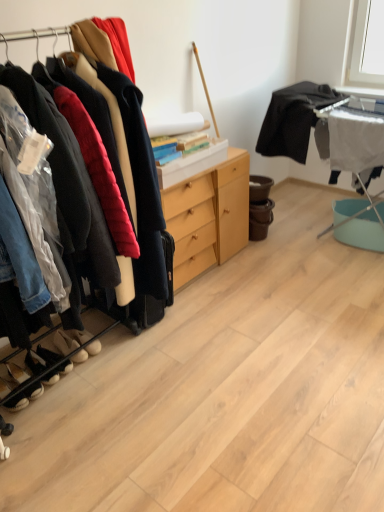
At what (x,y) coordinates should I click in order to perform the action: click on black suede shoes at lower left, acting as the third footwear starting from the front. Please return your answer as a coordinate pair (x, y). The width and height of the screenshot is (384, 512). Looking at the image, I should click on (48, 355).

Measure the distance between black suede shoes at lower left, which appears as the fourth footwear when viewed from the back, and camera.

They are 6.57 feet apart.

The height and width of the screenshot is (512, 384). In order to click on white suede shoes at lower left, which ranks as the 5th footwear in front-to-back order in this screenshot , I will do `click(79, 336)`.

Describe the element at coordinates (65, 342) in the screenshot. Image resolution: width=384 pixels, height=512 pixels. I see `suede beige shoes at lower left, the 2th footwear viewed from the back` at that location.

Find the location of `black suede shoes at lower left, arranged as the third footwear when viewed from the back`. black suede shoes at lower left, arranged as the third footwear when viewed from the back is located at coordinates (48, 355).

In the image, is black suede shoes at lower left, which appears as the second footwear when viewed from the front, positioned in front of or behind white suede shoes at lower left, the fifth footwear in the back-to-front sequence?

black suede shoes at lower left, which appears as the second footwear when viewed from the front, is positioned farther from the viewer than white suede shoes at lower left, the fifth footwear in the back-to-front sequence.

Measure the distance from black suede shoes at lower left, which appears as the fourth footwear when viewed from the back, to white suede shoes at lower left, the fifth footwear in the back-to-front sequence.

black suede shoes at lower left, which appears as the fourth footwear when viewed from the back, and white suede shoes at lower left, the fifth footwear in the back-to-front sequence, are 8.61 centimeters apart from each other.

Can you confirm if black suede shoes at lower left, which appears as the second footwear when viewed from the front, is bigger than white suede shoes at lower left, the fifth footwear in the back-to-front sequence?

No.

Does black suede shoes at lower left, which appears as the second footwear when viewed from the front, appear on the right side of white suede shoes at lower left, the 1th footwear viewed from the front?

Correct, you'll find black suede shoes at lower left, which appears as the second footwear when viewed from the front, to the right of white suede shoes at lower left, the 1th footwear viewed from the front.

Is white suede shoes at lower left, the fifth footwear in the back-to-front sequence, to the right of black suede shoes at lower left, arranged as the third footwear when viewed from the back, from the viewer's perspective?

Incorrect, white suede shoes at lower left, the fifth footwear in the back-to-front sequence, is not on the right side of black suede shoes at lower left, arranged as the third footwear when viewed from the back.

Looking at this image, can you tell me how much white suede shoes at lower left, the 1th footwear viewed from the front, and black suede shoes at lower left, acting as the third footwear starting from the front, differ in facing direction?

0.000767 degrees.

How much distance is there between white suede shoes at lower left, the fifth footwear in the back-to-front sequence, and black suede shoes at lower left, acting as the third footwear starting from the front?

6.27 inches.

In the image, is white suede shoes at lower left, the 1th footwear viewed from the front, positioned in front of or behind black suede shoes at lower left, arranged as the third footwear when viewed from the back?

white suede shoes at lower left, the 1th footwear viewed from the front, is positioned closer to the viewer than black suede shoes at lower left, arranged as the third footwear when viewed from the back.

Could you tell me if light wood/finely finished cabinet at center is turned towards white suede shoes at lower left, the 1th footwear viewed from the front?

No, light wood/finely finished cabinet at center does not turn towards white suede shoes at lower left, the 1th footwear viewed from the front.

Is light wood/finely finished cabinet at center bigger than white suede shoes at lower left, the fifth footwear in the back-to-front sequence?

Yes.

Image resolution: width=384 pixels, height=512 pixels. Identify the location of cabinetry that appears above the white suede shoes at lower left, the 1th footwear viewed from the front (from a real-world perspective). (208, 216).

From the image's perspective, is light wood/finely finished cabinet at center under white suede shoes at lower left, the fifth footwear in the back-to-front sequence?

Incorrect, from the image's perspective, light wood/finely finished cabinet at center is higher than white suede shoes at lower left, the fifth footwear in the back-to-front sequence.

Does white fabric ironing board at right have a larger size compared to suede beige shoes at lower left, placed as the 4th footwear when sorted from front to back?

Yes.

Is suede beige shoes at lower left, placed as the 4th footwear when sorted from front to back, inside white fabric ironing board at right?

Definitely not — suede beige shoes at lower left, placed as the 4th footwear when sorted from front to back, is not inside white fabric ironing board at right.

Between white fabric ironing board at right and suede beige shoes at lower left, placed as the 4th footwear when sorted from front to back, which one has larger width?

Wider between the two is suede beige shoes at lower left, placed as the 4th footwear when sorted from front to back.

Is black suede shoes at lower left, which appears as the second footwear when viewed from the front, facing towards black suede shoes at lower left, acting as the third footwear starting from the front?

No, black suede shoes at lower left, which appears as the second footwear when viewed from the front, is not aimed at black suede shoes at lower left, acting as the third footwear starting from the front.

Locate an element on the screen. footwear that is the 1st object directly below the black suede shoes at lower left, arranged as the third footwear when viewed from the back (from a real-world perspective) is located at coordinates (35, 362).

Between black suede shoes at lower left, which appears as the second footwear when viewed from the front, and black suede shoes at lower left, arranged as the third footwear when viewed from the back, which one has more height?

With more height is black suede shoes at lower left, which appears as the second footwear when viewed from the front.

Is point (78, 346) more distant than point (97, 341)?

No, (78, 346) is in front of (97, 341).

In the scene shown: Is suede beige shoes at lower left, placed as the 4th footwear when sorted from front to back, smaller than white suede shoes at lower left, the 1th footwear viewed from the back?

Yes.

Are suede beige shoes at lower left, placed as the 4th footwear when sorted from front to back, and white suede shoes at lower left, which ranks as the 5th footwear in front-to-back order, making contact?

Absolutely, suede beige shoes at lower left, placed as the 4th footwear when sorted from front to back, is next to and touching white suede shoes at lower left, which ranks as the 5th footwear in front-to-back order.

Is suede beige shoes at lower left, the 2th footwear viewed from the back, not within white suede shoes at lower left, which ranks as the 5th footwear in front-to-back order?

Yes, suede beige shoes at lower left, the 2th footwear viewed from the back, is located beyond the bounds of white suede shoes at lower left, which ranks as the 5th footwear in front-to-back order.

From the picture: From the image's perspective, which one is positioned lower, suede beige shoes at lower left, the 2th footwear viewed from the back, or light wood/finely finished cabinet at center?

suede beige shoes at lower left, the 2th footwear viewed from the back, is shown below in the image.

Does suede beige shoes at lower left, the 2th footwear viewed from the back, have a larger size compared to light wood/finely finished cabinet at center?

Actually, suede beige shoes at lower left, the 2th footwear viewed from the back, might be smaller than light wood/finely finished cabinet at center.

Which of these two, suede beige shoes at lower left, the 2th footwear viewed from the back, or light wood/finely finished cabinet at center, stands taller?

With more height is light wood/finely finished cabinet at center.

Would you say suede beige shoes at lower left, placed as the 4th footwear when sorted from front to back, contains light wood/finely finished cabinet at center?

That's incorrect, light wood/finely finished cabinet at center is not inside suede beige shoes at lower left, placed as the 4th footwear when sorted from front to back.

Where is `the 1st footwear above when counting from the white suede shoes at lower left, the fifth footwear in the back-to-front sequence (from the image's perspective)`? This screenshot has width=384, height=512. the 1st footwear above when counting from the white suede shoes at lower left, the fifth footwear in the back-to-front sequence (from the image's perspective) is located at coordinates (35, 362).

Identify the location of the 2nd footwear counting from the right of the white suede shoes at lower left, the 1th footwear viewed from the front. The image size is (384, 512). tap(48, 355).

Which object lies nearer to the anchor point white suede shoes at lower left, which ranks as the 5th footwear in front-to-back order, black matte shirt at upper right or light wood/finely finished cabinet at center?

light wood/finely finished cabinet at center lies closer to white suede shoes at lower left, which ranks as the 5th footwear in front-to-back order, than the other object.

From the image, which object appears to be nearer to black suede shoes at lower left, which appears as the fourth footwear when viewed from the back, light wood/finely finished cabinet at center or black suede shoes at lower left, acting as the third footwear starting from the front?

Based on the image, black suede shoes at lower left, acting as the third footwear starting from the front, appears to be nearer to black suede shoes at lower left, which appears as the fourth footwear when viewed from the back.

From the image, which object appears to be nearer to suede beige shoes at lower left, placed as the 4th footwear when sorted from front to back, black suede shoes at lower left, arranged as the third footwear when viewed from the back, or light wood/finely finished cabinet at center?

black suede shoes at lower left, arranged as the third footwear when viewed from the back, is positioned closer to the anchor suede beige shoes at lower left, placed as the 4th footwear when sorted from front to back.

When comparing their distances from black suede shoes at lower left, arranged as the third footwear when viewed from the back, does suede beige shoes at lower left, the 2th footwear viewed from the back, or black suede shoes at lower left, which appears as the fourth footwear when viewed from the back, seem further?

suede beige shoes at lower left, the 2th footwear viewed from the back, is further to black suede shoes at lower left, arranged as the third footwear when viewed from the back.

From the image, which object appears to be nearer to suede beige shoes at lower left, placed as the 4th footwear when sorted from front to back, white suede shoes at lower left, which ranks as the 5th footwear in front-to-back order, or white suede shoes at lower left, the fifth footwear in the back-to-front sequence?

white suede shoes at lower left, which ranks as the 5th footwear in front-to-back order, is closer to suede beige shoes at lower left, placed as the 4th footwear when sorted from front to back.

From the image, which object appears to be nearer to white suede shoes at lower left, the fifth footwear in the back-to-front sequence, suede beige shoes at lower left, placed as the 4th footwear when sorted from front to back, or light wood/finely finished cabinet at center?

Based on the image, suede beige shoes at lower left, placed as the 4th footwear when sorted from front to back, appears to be nearer to white suede shoes at lower left, the fifth footwear in the back-to-front sequence.

Looking at the image, which one is located further to black suede shoes at lower left, which appears as the fourth footwear when viewed from the back, white suede shoes at lower left, the 1th footwear viewed from the front, or light wood/finely finished cabinet at center?

The object further to black suede shoes at lower left, which appears as the fourth footwear when viewed from the back, is light wood/finely finished cabinet at center.

When comparing their distances from suede beige shoes at lower left, the 2th footwear viewed from the back, does light wood/finely finished cabinet at center or white suede shoes at lower left, the 1th footwear viewed from the front, seem closer?

Based on the image, white suede shoes at lower left, the 1th footwear viewed from the front, appears to be nearer to suede beige shoes at lower left, the 2th footwear viewed from the back.

Where is `footwear between black suede shoes at lower left, which appears as the second footwear when viewed from the front, and suede beige shoes at lower left, placed as the 4th footwear when sorted from front to back, along the z-axis`? The image size is (384, 512). footwear between black suede shoes at lower left, which appears as the second footwear when viewed from the front, and suede beige shoes at lower left, placed as the 4th footwear when sorted from front to back, along the z-axis is located at coordinates (48, 355).

Where is `footwear between light wood/finely finished cabinet at center and suede beige shoes at lower left, the 2th footwear viewed from the back, vertically`? The height and width of the screenshot is (512, 384). footwear between light wood/finely finished cabinet at center and suede beige shoes at lower left, the 2th footwear viewed from the back, vertically is located at coordinates (79, 336).

At what (x,y) coordinates should I click in order to perform the action: click on cabinetry between suede beige shoes at lower left, the 2th footwear viewed from the back, and white fabric ironing board at right, in the horizontal direction. Please return your answer as a coordinate pair (x, y). Looking at the image, I should click on (208, 216).

You are a GUI agent. You are given a task and a screenshot of the screen. Output one action in this format:
    pyautogui.click(x=<x>, y=<y>)
    Task: Click on the cabinetry between black suede shoes at lower left, which appears as the second footwear when viewed from the front, and white fabric ironing board at right, in the horizontal direction
    
    Given the screenshot: What is the action you would take?
    pyautogui.click(x=208, y=216)